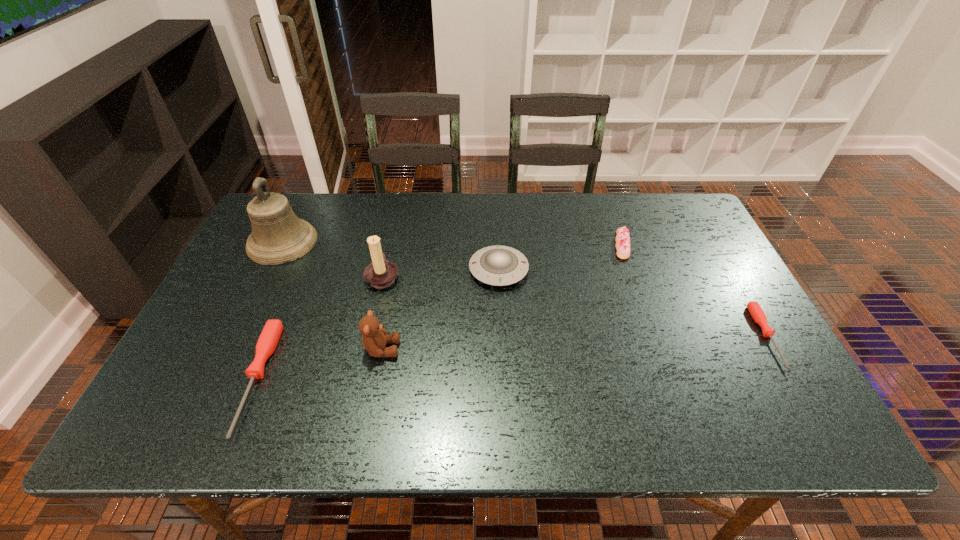
I want to click on free region at the far edge, so click(x=506, y=198).

The height and width of the screenshot is (540, 960). In the image, there is a desktop. In order to click on free region at the near edge in this screenshot , I will do `click(474, 383)`.

Find the location of a particular element. The image size is (960, 540). vacant space at the left edge of the desktop is located at coordinates (228, 284).

Image resolution: width=960 pixels, height=540 pixels. In order to click on free region at the right edge of the desktop in this screenshot , I will do `click(695, 285)`.

Image resolution: width=960 pixels, height=540 pixels. What are the coordinates of `vacant area at the far left corner` in the screenshot? It's located at (310, 194).

Where is `vacant space at the far right corner`? This screenshot has height=540, width=960. vacant space at the far right corner is located at coordinates (656, 224).

This screenshot has height=540, width=960. What are the coordinates of `free spot at the near right corner of the desktop` in the screenshot? It's located at (725, 380).

Image resolution: width=960 pixels, height=540 pixels. What are the coordinates of `free space between the candle holder and the bell` in the screenshot? It's located at (333, 259).

Where is `unoccupied area between the fourth tallest object and the second object from right to left`? Image resolution: width=960 pixels, height=540 pixels. unoccupied area between the fourth tallest object and the second object from right to left is located at coordinates [561, 257].

Where is `unoccupied position between the bell and the fifth shortest object`? This screenshot has width=960, height=540. unoccupied position between the bell and the fifth shortest object is located at coordinates (332, 295).